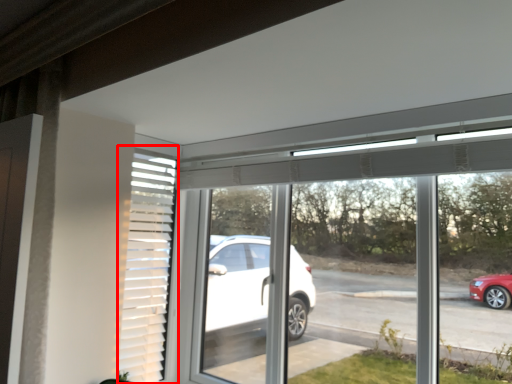
Question: From the image's perspective, where is shutter (annotated by the red box) located relative to window?

Choices:
 (A) below
 (B) above

Answer: (B)